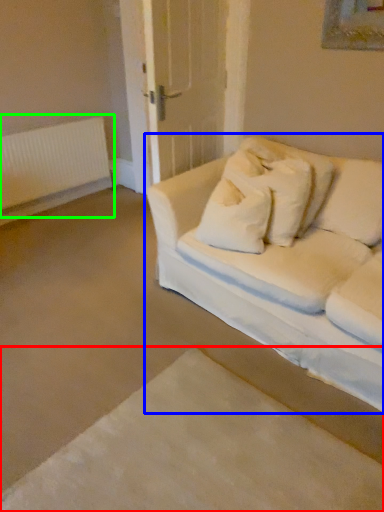
Question: Which is nearer to the bed frame (highlighted by a red box)? studio couch (highlighted by a blue box) or radiator (highlighted by a green box).

Choices:
 (A) studio couch
 (B) radiator

Answer: (A)